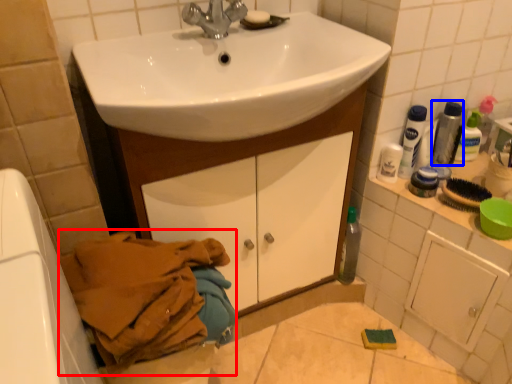
Question: Among these objects, which one is farthest to the camera, laundry (highlighted by a red box) or mouthwash (highlighted by a blue box)?

Choices:
 (A) laundry
 (B) mouthwash

Answer: (B)